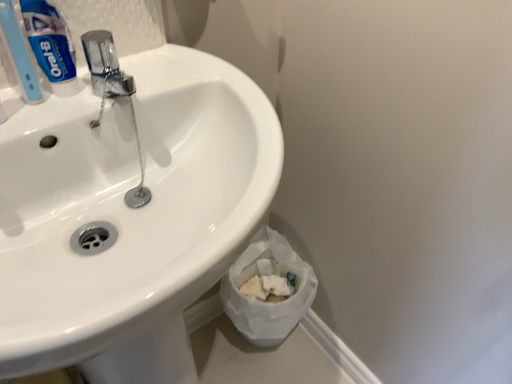
Question: From a real-world perspective, does blue glossy toothpaste at upper left sit lower than white crumpled paper at lower right?

Choices:
 (A) no
 (B) yes

Answer: (A)

Question: Would you say white crumpled paper at lower right is part of blue glossy toothpaste at upper left's contents?

Choices:
 (A) yes
 (B) no

Answer: (B)

Question: Can you confirm if blue glossy toothpaste at upper left is shorter than white crumpled paper at lower right?

Choices:
 (A) yes
 (B) no

Answer: (A)

Question: Is blue glossy toothpaste at upper left oriented away from white crumpled paper at lower right?

Choices:
 (A) no
 (B) yes

Answer: (A)

Question: Could you tell me if blue glossy toothpaste at upper left is turned towards white crumpled paper at lower right?

Choices:
 (A) no
 (B) yes

Answer: (A)

Question: Is blue glossy toothpaste at upper left completely or partially outside of white crumpled paper at lower right?

Choices:
 (A) no
 (B) yes

Answer: (B)

Question: Does light blue plastic toothbrush at upper left have a lesser height compared to white crumpled paper at lower right?

Choices:
 (A) yes
 (B) no

Answer: (A)

Question: Does light blue plastic toothbrush at upper left turn towards white crumpled paper at lower right?

Choices:
 (A) no
 (B) yes

Answer: (A)

Question: Is light blue plastic toothbrush at upper left looking in the opposite direction of white crumpled paper at lower right?

Choices:
 (A) no
 (B) yes

Answer: (A)

Question: Is light blue plastic toothbrush at upper left wider than white crumpled paper at lower right?

Choices:
 (A) no
 (B) yes

Answer: (A)

Question: Is light blue plastic toothbrush at upper left positioned behind white crumpled paper at lower right?

Choices:
 (A) yes
 (B) no

Answer: (B)

Question: Is light blue plastic toothbrush at upper left positioned before white crumpled paper at lower right?

Choices:
 (A) no
 (B) yes

Answer: (B)

Question: Would you consider blue glossy toothpaste at upper left to be distant from light blue plastic toothbrush at upper left?

Choices:
 (A) yes
 (B) no

Answer: (B)